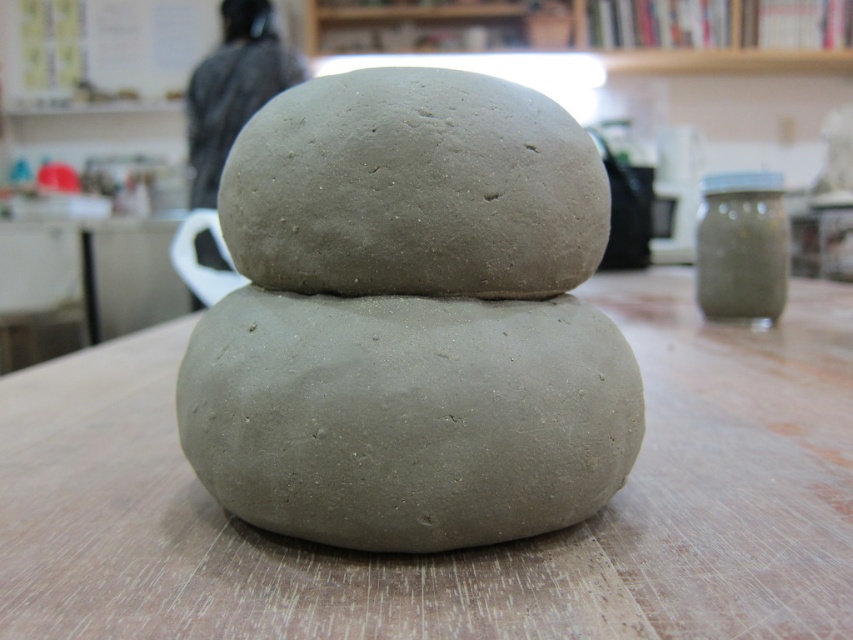
Question: In this image, where is gray matte clay at center located relative to gray matte stone at center?

Choices:
 (A) right
 (B) left

Answer: (B)

Question: Does matte gray clay at center have a lesser width compared to gray matte stone at center?

Choices:
 (A) no
 (B) yes

Answer: (A)

Question: Which point is farther to the camera?

Choices:
 (A) (358, 124)
 (B) (152, 572)
 (C) (490, 368)

Answer: (A)

Question: Can you confirm if matte gray clay at center is bigger than gray matte stone at center?

Choices:
 (A) no
 (B) yes

Answer: (B)

Question: Estimate the real-world distances between objects in this image. Which object is closer to the matte gray clay at center?

Choices:
 (A) gray matte clay at center
 (B) gray matte stone at center

Answer: (A)

Question: Estimate the real-world distances between objects in this image. Which object is farther from the gray matte stone at center?

Choices:
 (A) matte gray clay at center
 (B) gray matte clay at center

Answer: (A)